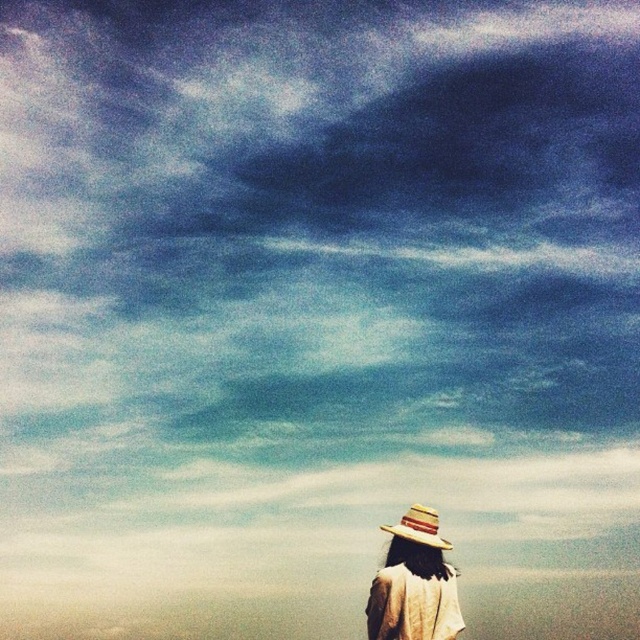
Question: Considering the relative positions of straw hat at lower center and natural straw hat at lower center in the image provided, where is straw hat at lower center located with respect to natural straw hat at lower center?

Choices:
 (A) right
 (B) left

Answer: (A)

Question: Which point is farther from the camera taking this photo?

Choices:
 (A) (440, 627)
 (B) (419, 522)

Answer: (B)

Question: Can you confirm if straw hat at lower center is bigger than natural straw hat at lower center?

Choices:
 (A) no
 (B) yes

Answer: (B)

Question: Which of the following is the closest to the observer?

Choices:
 (A) natural straw hat at lower center
 (B) straw hat at lower center

Answer: (B)

Question: Is straw hat at lower center to the left of natural straw hat at lower center from the viewer's perspective?

Choices:
 (A) no
 (B) yes

Answer: (A)